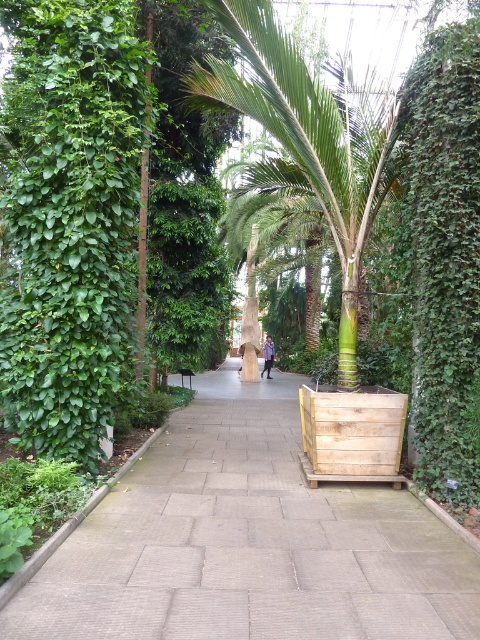
Looking at this image, you are a gardener standing on the brown stone pavement at center and want to trim the green leafy hedge at right. Which tool should you use, a short ladder or a long ladder?

The green leafy hedge at right is further away from you than the brown stone pavement at center, so you should use a long ladder to reach it.

You are standing at the entrance of the botanical garden and want to walk to the brown stone pavement at center. According to the coordinates provided, in which direction should you head from your current position?

The brown stone pavement at center is located at coordinates point (249, 541). Since coordinates typically increase from the bottom left corner, this position is towards the upper right of the image. Therefore, you should head towards the upper right direction from your current position to reach the brown stone pavement at center.

You are standing at the center of the pathway in the botanical garden. You notice a point marked at coordinates (444, 257). What does this point correspond to in the scene?

The point at coordinates (444, 257) corresponds to the green leafy hedge at right.